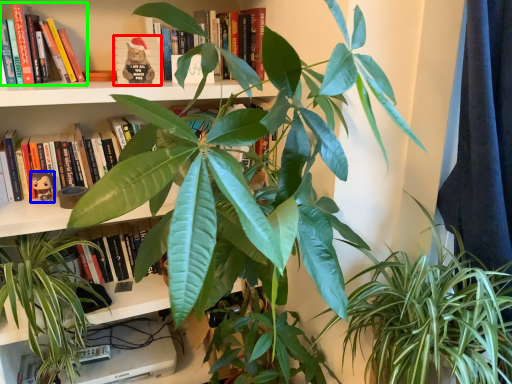
Question: Estimate the real-world distances between objects in this image. Which object is farther from paperback book (highlighted by a red box), toy (highlighted by a blue box) or book (highlighted by a green box)?

Choices:
 (A) toy
 (B) book

Answer: (A)